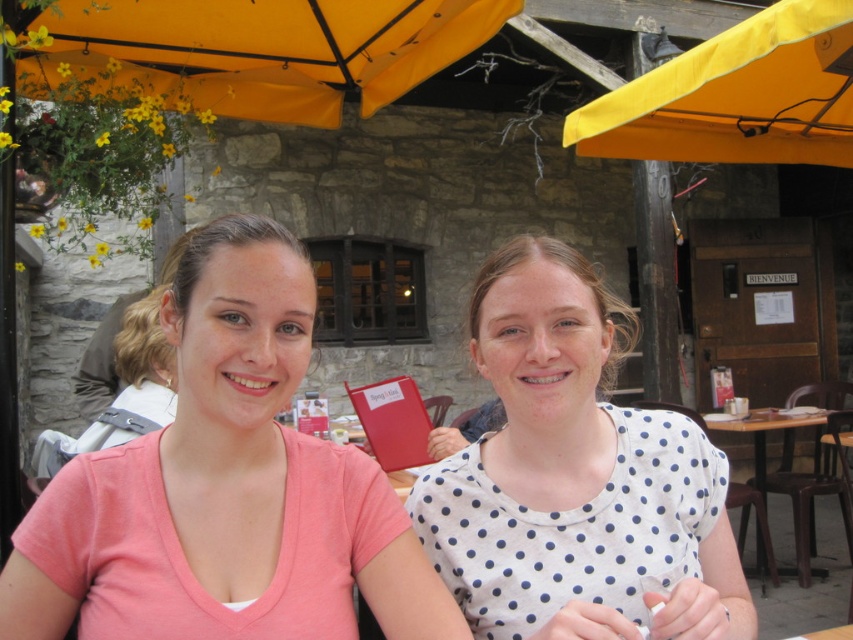
You are a photographer setting up for a group photo. You notice the white dotted shirt at center and the yellow fabric canopy at upper center. Which object is wider?

The yellow fabric canopy at upper center is wider than the white dotted shirt at center.

You are a photographer setting up for a portrait. You see the white dotted shirt at center and the yellow fabric canopy at upper center. Which object is closer to the camera?

The white dotted shirt at center is positioned under the yellow fabric canopy at upper center, so the yellow fabric canopy at upper center is closer to the camera.